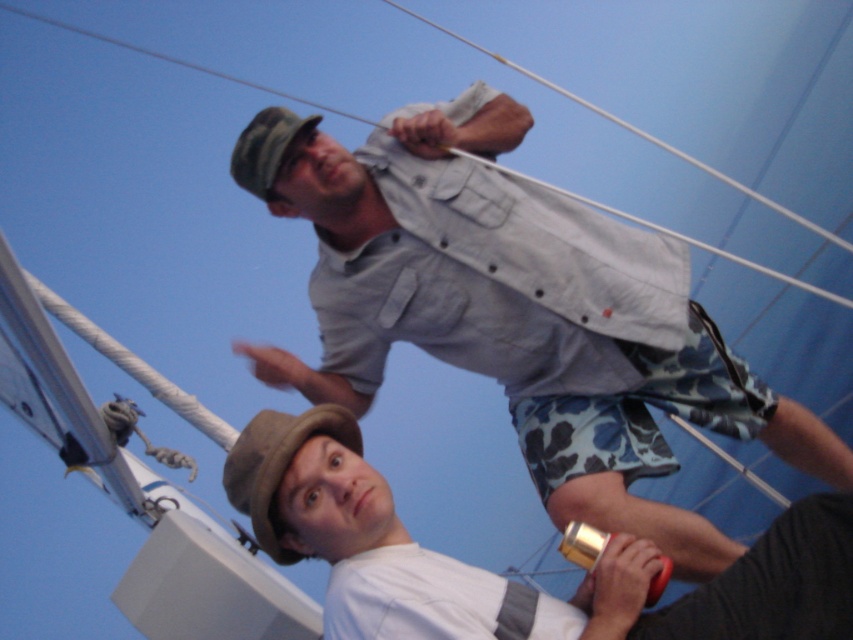
You are a photographer trying to capture both the light gray fabric shirt at upper center and the camouflage fabric hat at upper center in a single shot. Given that your camera can only focus on objects within a certain size range, which object might be more challenging to focus on, and why?

The camouflage fabric hat at upper center might be more challenging to focus on because it is smaller than the light gray fabric shirt at upper center, making it harder to capture clearly within the camera focus range.

You are standing on the dock and want to hand a bottle to the person wearing the brown felt hat at lower center. The bottle is 1 foot long. Can you reach them without moving closer?

The brown felt hat at lower center is 4.99 feet away from the viewer. Since the bottle is only 1 foot long, you cannot reach them without moving closer as the distance is greater than the bottle length.

You are a photographer trying to capture a photo of both the light gray fabric shirt at upper center and the brown felt hat at lower center in the same frame. Based on their positions, which direction should you adjust your camera to include both subjects?

The light gray fabric shirt at upper center is to the right of the brown felt hat at lower center, so you should adjust your camera to the left to include both subjects.